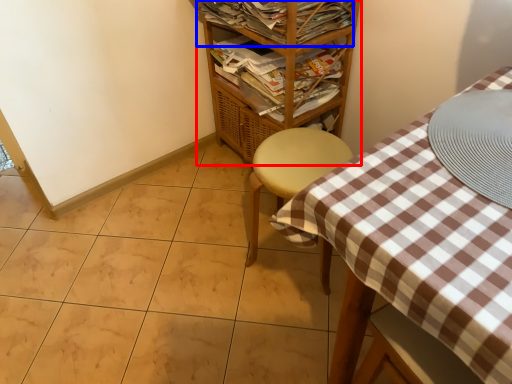
Question: Which of the following is the farthest to the observer, shelf (highlighted by a red box) or magazine (highlighted by a blue box)?

Choices:
 (A) shelf
 (B) magazine

Answer: (B)